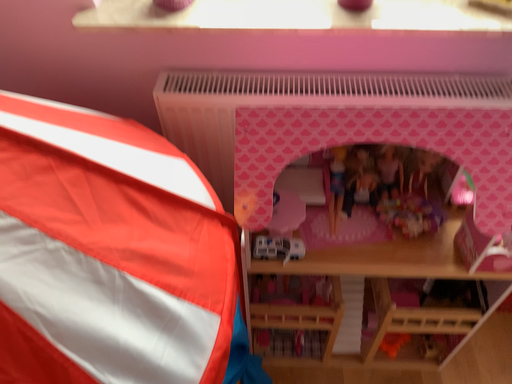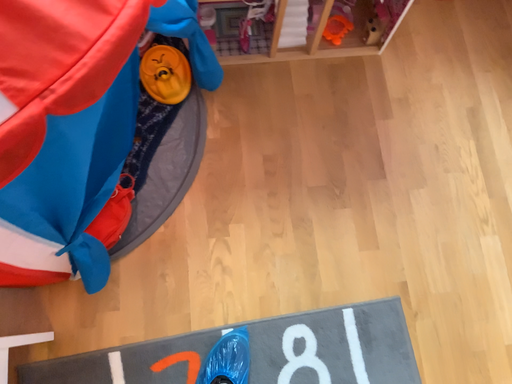
Question: Which way did the camera rotate in the video?

Choices:
 (A) rotated upward
 (B) rotated downward

Answer: (B)